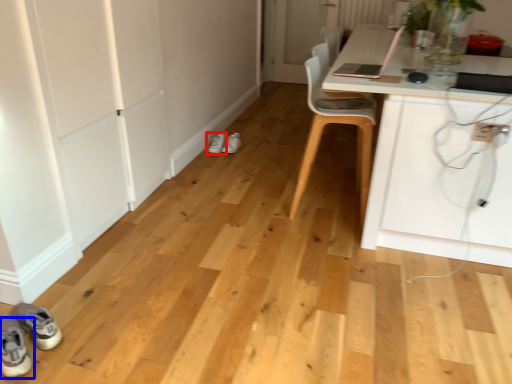
Question: Which point is closer to the camera, footwear (highlighted by a red box) or footwear (highlighted by a blue box)?

Choices:
 (A) footwear
 (B) footwear

Answer: (B)